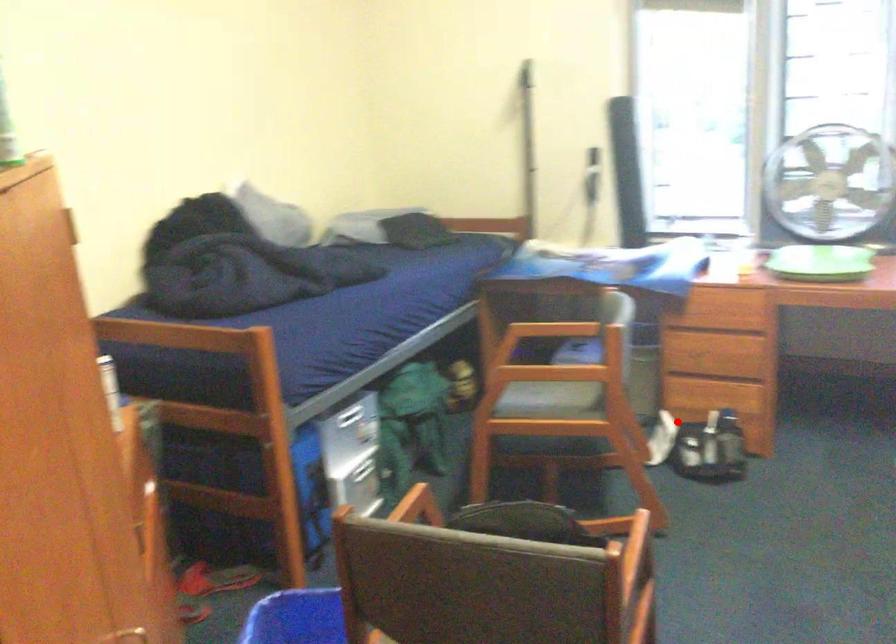
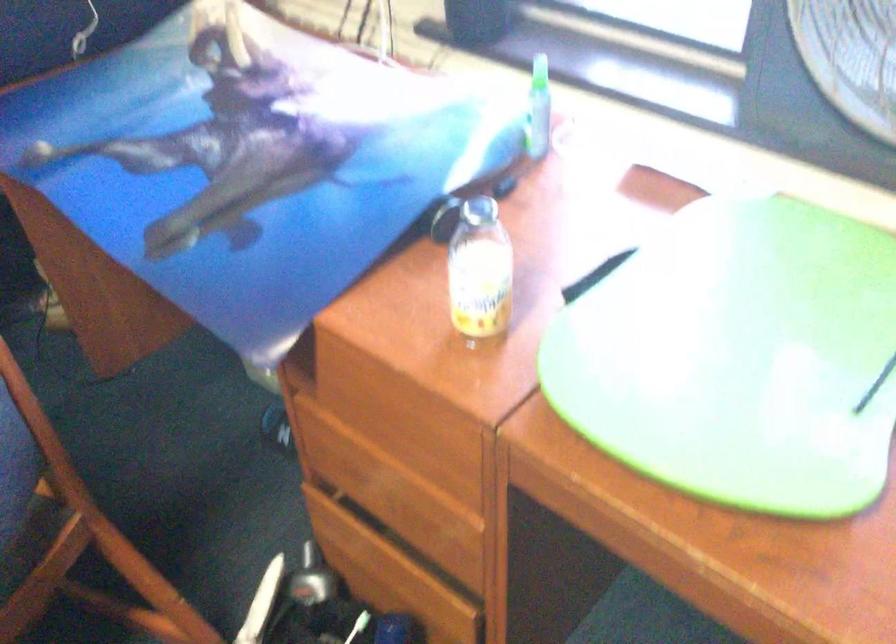
Question: A red point is marked in image1. In image2, is the corresponding 3D point closer to the camera or farther? Reply with the corresponding letter.

Choices:
 (A) The corresponding 3D point is closer.
 (B) The corresponding 3D point is farther.

Answer: (A)